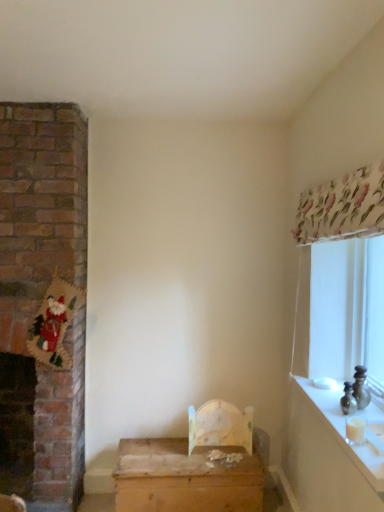
Find the location of `wooden chest at center`. wooden chest at center is located at coordinates (184, 479).

What do you see at coordinates (184, 479) in the screenshot? The width and height of the screenshot is (384, 512). I see `wooden chest at center` at bounding box center [184, 479].

What do you see at coordinates (343, 430) in the screenshot?
I see `white glossy counter top at right` at bounding box center [343, 430].

Find the location of a particular element. Image resolution: width=384 pixels, height=512 pixels. white glossy counter top at right is located at coordinates (343, 430).

What is the approximate width of white glossy counter top at right?

white glossy counter top at right is 29.59 centimeters in width.

The image size is (384, 512). Identify the location of wooden chest at center. (184, 479).

Considering the relative positions of wooden chest at center and white glossy counter top at right in the image provided, is wooden chest at center to the right of white glossy counter top at right from the viewer's perspective?

In fact, wooden chest at center is to the left of white glossy counter top at right.

In the image, is wooden chest at center positioned in front of or behind white glossy counter top at right?

Clearly, wooden chest at center is behind white glossy counter top at right.

Is point (258, 459) farther from viewer compared to point (349, 450)?

Yes, point (258, 459) is behind point (349, 450).

From the image's perspective, does wooden chest at center appear higher than white glossy counter top at right?

No, from the image's perspective, wooden chest at center is not over white glossy counter top at right.

From a real-world perspective, who is located lower, wooden chest at center or white glossy counter top at right?

wooden chest at center is physically lower.

Looking at their sizes, would you say wooden chest at center is wider or thinner than white glossy counter top at right?

In the image, wooden chest at center appears to be wider than white glossy counter top at right.

Looking at this image, is wooden chest at center shorter than white glossy counter top at right?

In fact, wooden chest at center may be taller than white glossy counter top at right.

Does wooden chest at center have a smaller size compared to white glossy counter top at right?

No.

Choose the correct answer: Is wooden chest at center inside white glossy counter top at right or outside it?

wooden chest at center is outside white glossy counter top at right.

Is there a large distance between wooden chest at center and white glossy counter top at right?

wooden chest at center is actually quite close to white glossy counter top at right.

Is white glossy counter top at right at the back of wooden chest at center?

No, wooden chest at center's orientation is not away from white glossy counter top at right.

At what (x,y) coordinates should I click in order to perform the action: click on counter top in front of the wooden chest at center. Please return your answer as a coordinate pair (x, y). The width and height of the screenshot is (384, 512). Looking at the image, I should click on (343, 430).

From the picture: Can you confirm if white glossy counter top at right is positioned to the right of wooden chest at center?

Yes.

Is white glossy counter top at right further to the viewer compared to wooden chest at center?

No, white glossy counter top at right is closer to the camera.

Looking at this image, which point is more distant from viewer, (374, 412) or (189, 504)?

The point (189, 504) is farther.

In the scene shown: From the image's perspective, would you say white glossy counter top at right is shown under wooden chest at center?

No, from the image's perspective, white glossy counter top at right is not below wooden chest at center.

Based on the photo, from a real-world perspective, which object rests below the other?

wooden chest at center, from a real-world perspective.

Is white glossy counter top at right wider or thinner than wooden chest at center?

Considering their sizes, white glossy counter top at right looks slimmer than wooden chest at center.

From the picture: Is white glossy counter top at right taller than wooden chest at center?

In fact, white glossy counter top at right may be shorter than wooden chest at center.

Based on their sizes in the image, would you say white glossy counter top at right is bigger or smaller than wooden chest at center?

Considering their sizes, white glossy counter top at right takes up less space than wooden chest at center.

Is white glossy counter top at right positioned beyond the bounds of wooden chest at center?

white glossy counter top at right is positioned outside wooden chest at center.

Would you consider white glossy counter top at right to be distant from wooden chest at center?

white glossy counter top at right is near wooden chest at center, not far away.

Is white glossy counter top at right aimed at wooden chest at center?

No, white glossy counter top at right is not oriented towards wooden chest at center.

Where is `counter top that appears above the wooden chest at center (from the image's perspective)`? counter top that appears above the wooden chest at center (from the image's perspective) is located at coordinates (343, 430).

Identify the location of counter top that is above the wooden chest at center (from the image's perspective). Image resolution: width=384 pixels, height=512 pixels. (343, 430).

Where is `table below the white glossy counter top at right (from a real-world perspective)`? The width and height of the screenshot is (384, 512). table below the white glossy counter top at right (from a real-world perspective) is located at coordinates (184, 479).